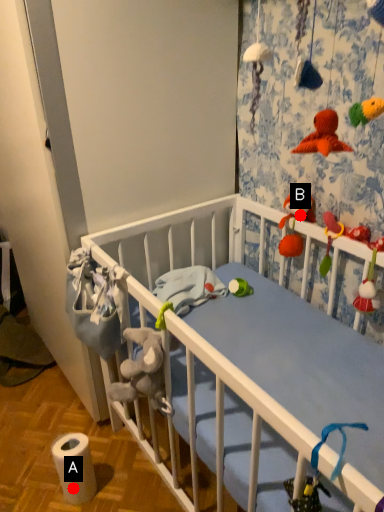
Question: Two points are circled on the image, labeled by A and B beside each circle. Which point is further to the camera?

Choices:
 (A) A is further
 (B) B is further

Answer: (B)